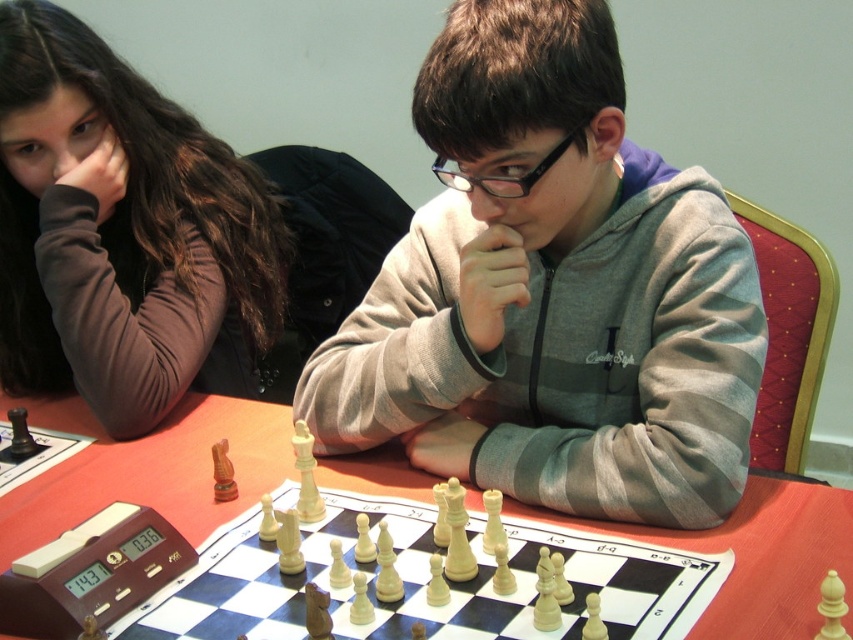
Consider the image. Does gray fleece hoodie at center appear on the right side of matte brown hair at upper left?

Indeed, gray fleece hoodie at center is positioned on the right side of matte brown hair at upper left.

Does gray fleece hoodie at center have a greater width compared to matte brown hair at upper left?

Yes.

The width and height of the screenshot is (853, 640). What do you see at coordinates (553, 292) in the screenshot? I see `gray fleece hoodie at center` at bounding box center [553, 292].

At what (x,y) coordinates should I click in order to perform the action: click on gray fleece hoodie at center. Please return your answer as a coordinate pair (x, y). This screenshot has height=640, width=853. Looking at the image, I should click on click(x=553, y=292).

Does wooden chessboard at center have a lesser height compared to white wooden chessboard at center?

No.

Is wooden chessboard at center below white wooden chessboard at center?

No, wooden chessboard at center is not below white wooden chessboard at center.

The height and width of the screenshot is (640, 853). What are the coordinates of `wooden chessboard at center` in the screenshot? It's located at (148, 468).

Is point (88, 36) positioned before point (641, 634)?

No, it is behind (641, 634).

Between matte brown hair at upper left and white wooden chessboard at center, which one appears on the right side from the viewer's perspective?

Positioned to the right is white wooden chessboard at center.

Between point (125, 157) and point (329, 493), which one is positioned in front?

Positioned in front is point (329, 493).

The height and width of the screenshot is (640, 853). Identify the location of matte brown hair at upper left. (122, 234).